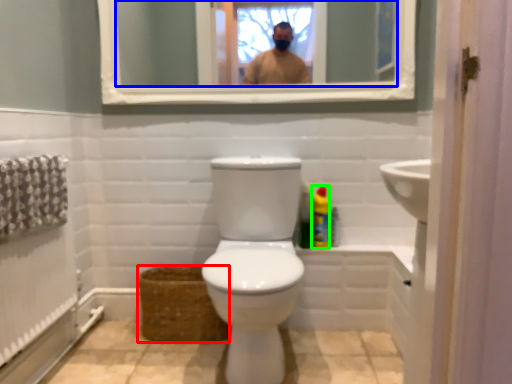
Question: Which is farther away from basket (highlighted by a red box)? mirror (highlighted by a blue box) or cleaning product (highlighted by a green box)?

Choices:
 (A) mirror
 (B) cleaning product

Answer: (A)